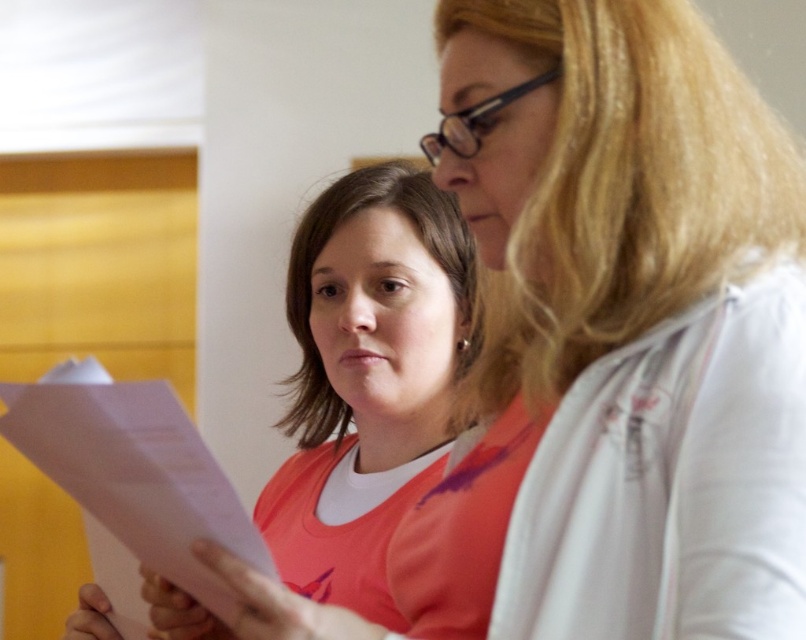
Question: Which point is closer to the camera?

Choices:
 (A) pink matte paper at center
 (B) pink paper at lower left

Answer: (B)

Question: Does pink matte paper at center have a larger size compared to pink paper at lower left?

Choices:
 (A) yes
 (B) no

Answer: (A)

Question: Does pink matte paper at center have a greater width compared to pink paper at lower left?

Choices:
 (A) yes
 (B) no

Answer: (A)

Question: Does pink matte paper at center have a smaller size compared to pink paper at lower left?

Choices:
 (A) no
 (B) yes

Answer: (A)

Question: Which point is farther from the camera taking this photo?

Choices:
 (A) (408, 252)
 (B) (148, 397)

Answer: (A)